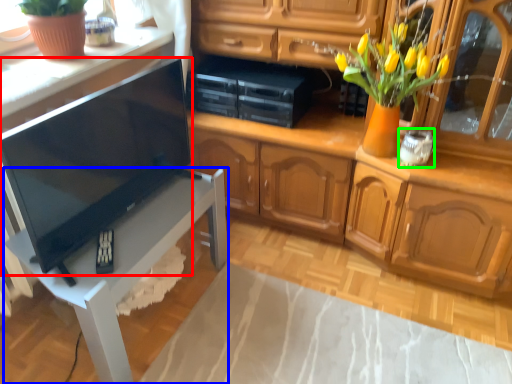
Question: Which object is positioned farthest from television (highlighted by a red box)? Select from table (highlighted by a blue box) and appliance (highlighted by a green box).

Choices:
 (A) table
 (B) appliance

Answer: (B)